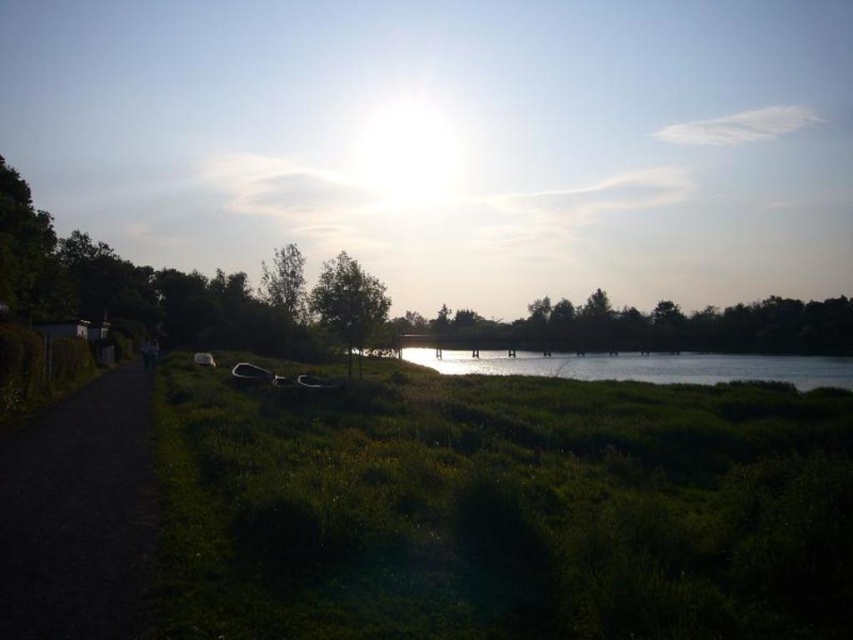
Between green matte grass at center and green leafy tree at center, which one appears on the right side from the viewer's perspective?

Positioned to the right is green matte grass at center.

Between point (442, 531) and point (314, 305), which one is positioned in front?

Point (442, 531) is in front.

Does point (581, 483) lie in front of point (361, 344)?

That is True.

Image resolution: width=853 pixels, height=640 pixels. In order to click on green matte grass at center in this screenshot , I will do `click(503, 508)`.

Which is more to the right, dark asphalt path at left or silvery reflective water at center?

silvery reflective water at center is more to the right.

Measure the distance between dark asphalt path at left and camera.

The distance of dark asphalt path at left from camera is 8.80 meters.

I want to click on dark asphalt path at left, so click(79, 513).

Describe the element at coordinates (503, 508) in the screenshot. I see `green matte grass at center` at that location.

In the scene shown: Which of these two, green matte grass at center or dark asphalt path at left, stands taller?

With more height is green matte grass at center.

What do you see at coordinates (503, 508) in the screenshot? The image size is (853, 640). I see `green matte grass at center` at bounding box center [503, 508].

This screenshot has height=640, width=853. I want to click on green matte grass at center, so pos(503,508).